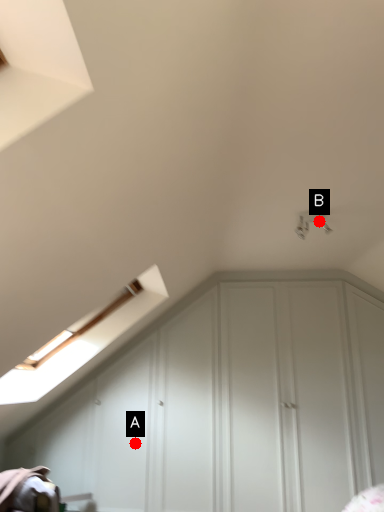
Question: Two points are circled on the image, labeled by A and B beside each circle. Which of the following is the closest to the observer?

Choices:
 (A) A is closer
 (B) B is closer

Answer: (B)